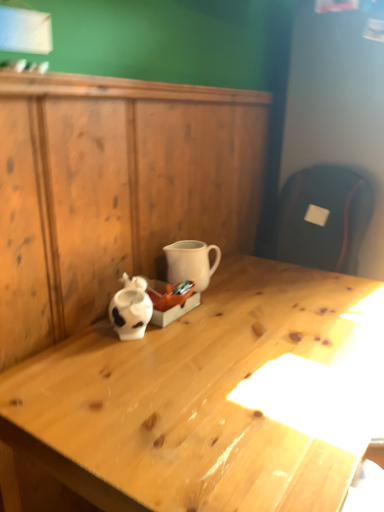
You are a GUI agent. You are given a task and a screenshot of the screen. Output one action in this format:
    pyautogui.click(x=<x>, y=<y>)
    Task: Click on the free space above wooden dresser at center (from a real-world perspective)
    
    Given the screenshot: What is the action you would take?
    pyautogui.click(x=174, y=80)